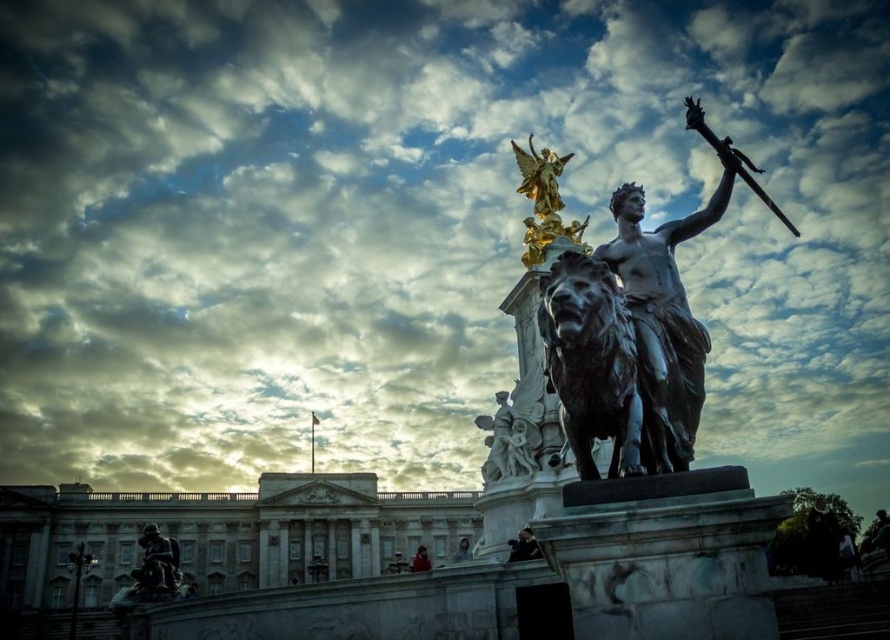
You are an art student analyzing the composition of the scene. You notice the gold polished statue at upper center and the bronze statue at lower left. Which one is placed to the right of the other?

The gold polished statue at upper center is positioned on the right side of bronze statue at lower left.

You are an art student analyzing the composition of the image. You notice the gold polished statue at upper center and the bronze statue at lower left. Which statue has a narrower width?

The gold polished statue at upper center is thinner than the bronze statue at lower left, so it has a narrower width.